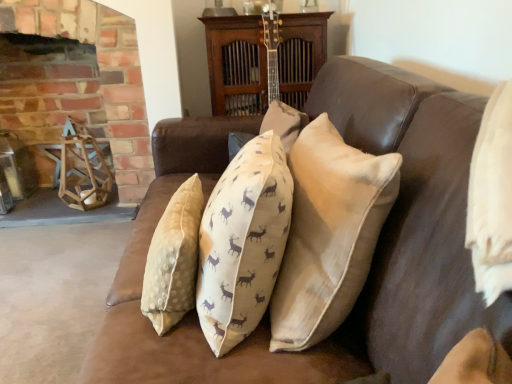
Question: Is brick fireplace at upper left at the back of beige textured pillow at center?

Choices:
 (A) yes
 (B) no

Answer: (B)

Question: Does beige textured pillow at center have a lesser height compared to brick fireplace at upper left?

Choices:
 (A) no
 (B) yes

Answer: (B)

Question: Can you confirm if beige textured pillow at center is taller than brick fireplace at upper left?

Choices:
 (A) no
 (B) yes

Answer: (A)

Question: Is beige textured pillow at center far from brick fireplace at upper left?

Choices:
 (A) yes
 (B) no

Answer: (A)

Question: From a real-world perspective, is beige textured pillow at center located higher than brick fireplace at upper left?

Choices:
 (A) no
 (B) yes

Answer: (B)

Question: Does beige textured pillow at center appear on the right side of brick fireplace at upper left?

Choices:
 (A) no
 (B) yes

Answer: (B)

Question: From the image's perspective, is brick fireplace at upper left below beige textured pillow at center?

Choices:
 (A) no
 (B) yes

Answer: (A)

Question: Is the depth of brick fireplace at upper left less than that of beige textured pillow at center?

Choices:
 (A) no
 (B) yes

Answer: (A)

Question: Can you confirm if brick fireplace at upper left is bigger than beige textured pillow at center?

Choices:
 (A) no
 (B) yes

Answer: (B)

Question: Is brick fireplace at upper left thinner than beige textured pillow at center?

Choices:
 (A) no
 (B) yes

Answer: (A)

Question: Is brick fireplace at upper left with beige textured pillow at center?

Choices:
 (A) yes
 (B) no

Answer: (B)

Question: Are brick fireplace at upper left and beige textured pillow at center far apart?

Choices:
 (A) yes
 (B) no

Answer: (A)

Question: In terms of size, does brick fireplace at upper left appear bigger or smaller than beige textured pillow at center?

Choices:
 (A) small
 (B) big

Answer: (B)